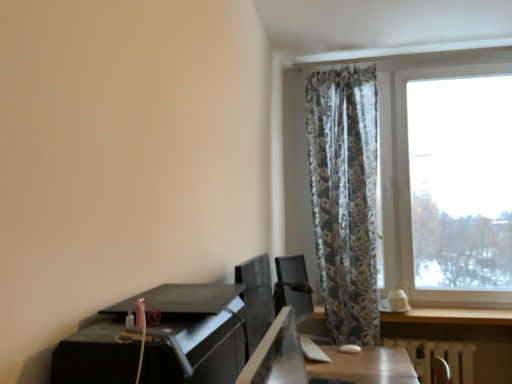
Question: Considering the relative positions of transparent glass window at right and satin black monitor at center in the image provided, is transparent glass window at right to the left of satin black monitor at center from the viewer's perspective?

Choices:
 (A) no
 (B) yes

Answer: (A)

Question: Does transparent glass window at right have a lesser height compared to satin black monitor at center?

Choices:
 (A) no
 (B) yes

Answer: (B)

Question: Is transparent glass window at right placed right next to satin black monitor at center?

Choices:
 (A) no
 (B) yes

Answer: (A)

Question: Considering the relative sizes of transparent glass window at right and satin black monitor at center in the image provided, is transparent glass window at right wider than satin black monitor at center?

Choices:
 (A) no
 (B) yes

Answer: (B)

Question: Does transparent glass window at right have a greater height compared to satin black monitor at center?

Choices:
 (A) yes
 (B) no

Answer: (B)

Question: Is white textured radiator at lower right in front of or behind transparent glass window at right in the image?

Choices:
 (A) front
 (B) behind

Answer: (B)

Question: Considering the relative positions of white textured radiator at lower right and transparent glass window at right in the image provided, is white textured radiator at lower right to the left or to the right of transparent glass window at right?

Choices:
 (A) left
 (B) right

Answer: (B)

Question: Do you think white textured radiator at lower right is within transparent glass window at right, or outside of it?

Choices:
 (A) inside
 (B) outside

Answer: (B)

Question: Looking at the image, does white textured radiator at lower right seem bigger or smaller compared to transparent glass window at right?

Choices:
 (A) small
 (B) big

Answer: (B)

Question: Is white textured radiator at lower right spatially inside black glossy desk at lower left, or outside of it?

Choices:
 (A) outside
 (B) inside

Answer: (A)

Question: Based on their sizes in the image, would you say white textured radiator at lower right is bigger or smaller than black glossy desk at lower left?

Choices:
 (A) small
 (B) big

Answer: (B)

Question: Is white textured radiator at lower right wider or thinner than black glossy desk at lower left?

Choices:
 (A) wide
 (B) thin

Answer: (B)

Question: From the image's perspective, is white textured radiator at lower right above or below black glossy desk at lower left?

Choices:
 (A) below
 (B) above

Answer: (A)

Question: Considering the positions of transparent glass window at right and white textured radiator at lower right in the image, is transparent glass window at right wider or thinner than white textured radiator at lower right?

Choices:
 (A) thin
 (B) wide

Answer: (B)

Question: Is point (505, 317) positioned closer to the camera than point (415, 357)?

Choices:
 (A) farther
 (B) closer

Answer: (A)